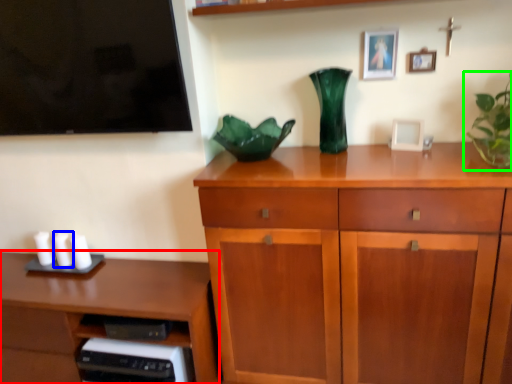
Question: Estimate the real-world distances between objects in this image. Which object is farther from desk (highlighted by a red box), candle (highlighted by a blue box) or houseplant (highlighted by a green box)?

Choices:
 (A) candle
 (B) houseplant

Answer: (B)